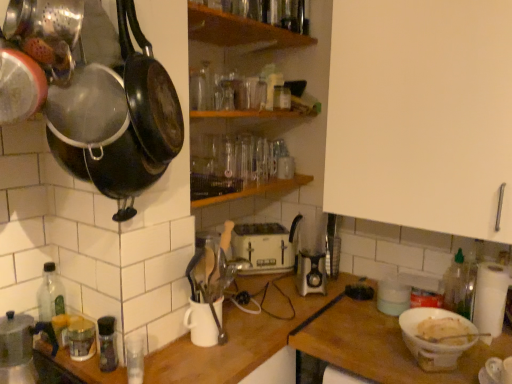
The image size is (512, 384). I want to click on vacant area that is situated to the right of clear glass bottle at lower left, marked as the 2th bottle in a right-to-left arrangement, so click(x=187, y=365).